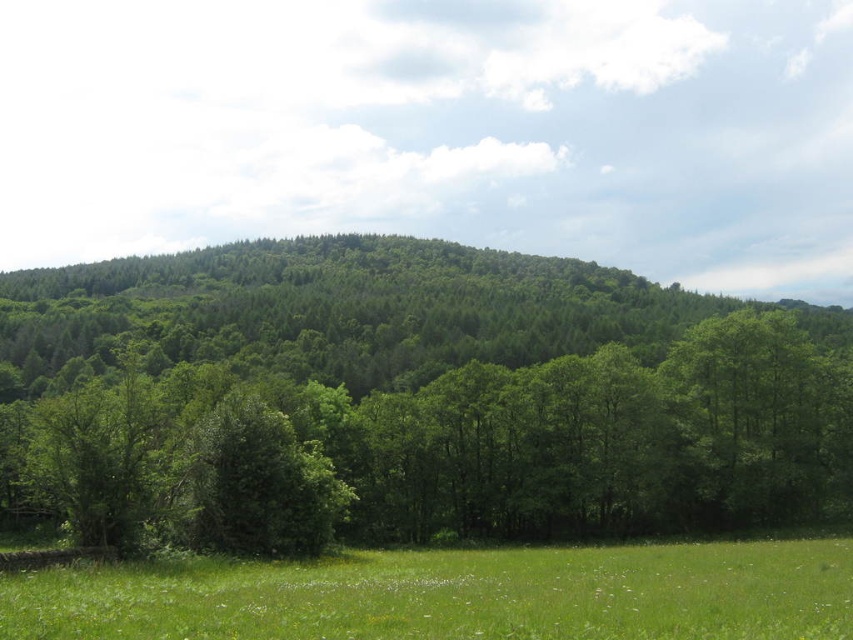
Is point (210, 285) closer to viewer compared to point (165, 570)?

No, (210, 285) is further to viewer.

Is green leafy tree at center thinner than green grassy field at lower center?

In fact, green leafy tree at center might be wider than green grassy field at lower center.

Who is more forward, (809, 368) or (456, 611)?

Positioned in front is point (456, 611).

Identify the location of green leafy tree at center. (479, 380).